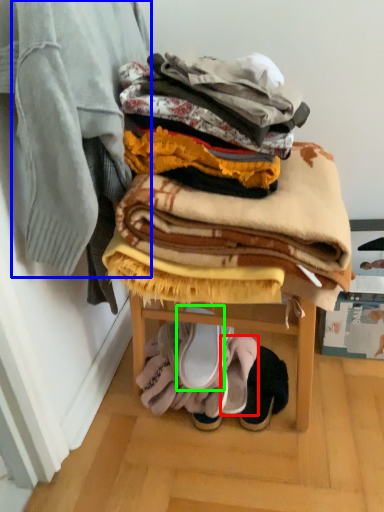
Question: Which object is the closest to the footwear (highlighted by a red box)? Choose among these: blanket (highlighted by a blue box) or footwear (highlighted by a green box).

Choices:
 (A) blanket
 (B) footwear

Answer: (B)